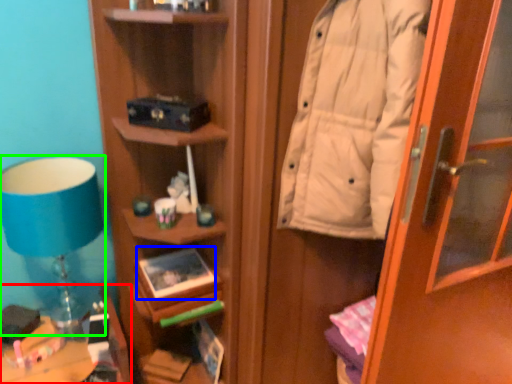
Question: Which object is positioned closest to furniture (highlighted by a red box)? Select from book (highlighted by a blue box) and table lamp (highlighted by a green box).

Choices:
 (A) book
 (B) table lamp

Answer: (A)